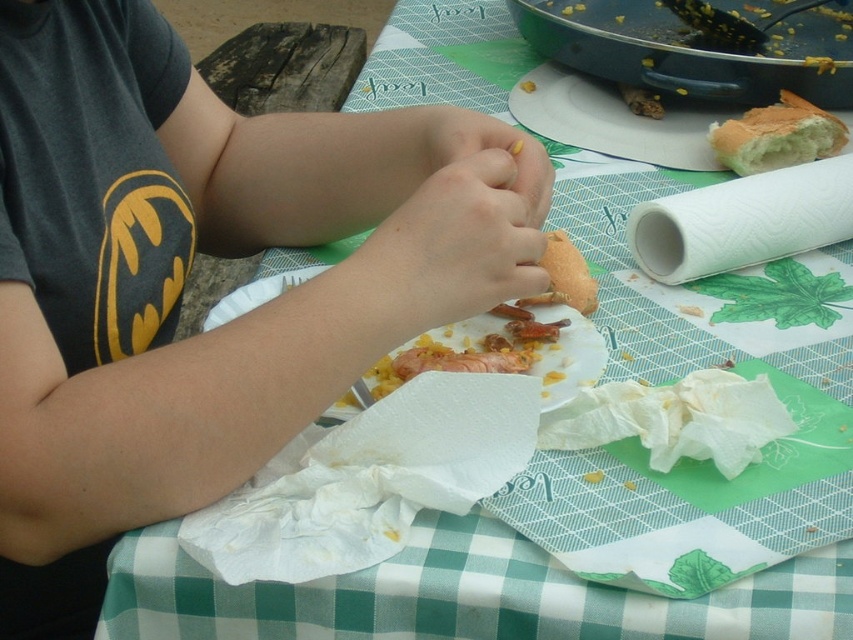
Does point (442, 221) lie in front of point (561, 257)?

Yes, it is.

Consider the image. Is matte black shirt at upper left smaller than orange matte bread at center?

No.

The image size is (853, 640). Identify the location of matte black shirt at upper left. (186, 273).

Which is above, white paper plate at upper right or bread at upper right?

white paper plate at upper right is higher up.

Where is `white paper plate at upper right`? This screenshot has height=640, width=853. white paper plate at upper right is located at coordinates (608, 122).

Is the position of white paper at right less distant than that of orange matte bread at center?

No, white paper at right is behind orange matte bread at center.

Who is more distant from viewer, (703,188) or (554,276)?

The point (703,188) is more distant.

This screenshot has height=640, width=853. In order to click on white paper at right in this screenshot , I will do `click(741, 221)`.

This screenshot has height=640, width=853. What are the coordinates of `white paper at right` in the screenshot? It's located at (741, 221).